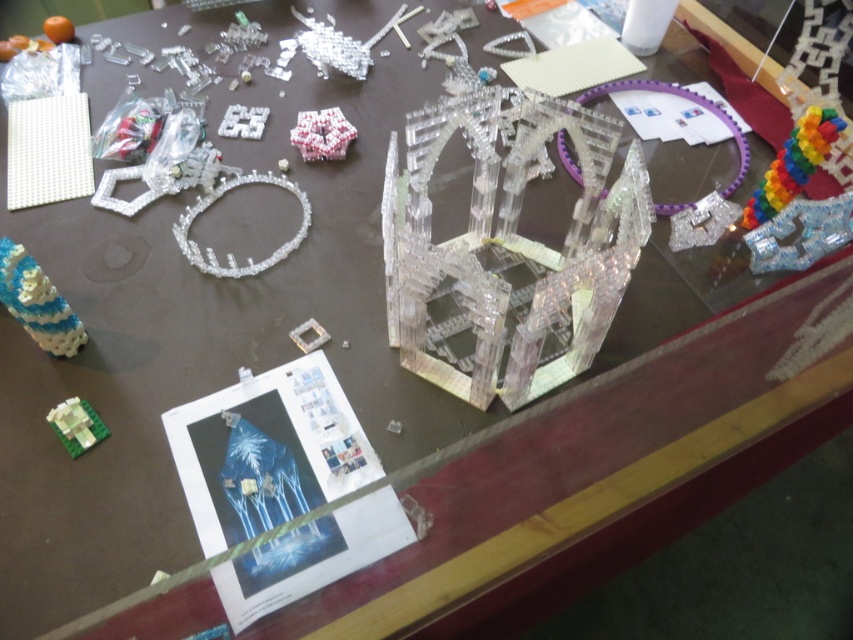
Is translucent plastic cube at center bigger than clear plastic square at center?

Yes.

Between translucent plastic cube at center and clear plastic square at center, which one is positioned higher?

translucent plastic cube at center is higher up.

Identify the location of translucent plastic cube at center. (322, 134).

Does translucent plastic rainbow cube at upper right have a larger size compared to clear plastic puzzle at upper center?

Indeed, translucent plastic rainbow cube at upper right has a larger size compared to clear plastic puzzle at upper center.

Looking at this image, who is taller, translucent plastic rainbow cube at upper right or clear plastic puzzle at upper center?

Standing taller between the two is translucent plastic rainbow cube at upper right.

Is point (759, 202) farther from camera compared to point (241, 115)?

No, (759, 202) is closer to viewer.

This screenshot has width=853, height=640. Identify the location of translucent plastic rainbow cube at upper right. (793, 163).

Is point (436, 276) behind point (74, 420)?

No, it is not.

Based on the photo, does transparent plastic tower at center appear under green matte block at lower left?

Actually, transparent plastic tower at center is above green matte block at lower left.

Does point (509, 266) come farther from viewer compared to point (90, 445)?

Yes, point (509, 266) is farther from viewer.

Where is `transparent plastic tower at center`? Image resolution: width=853 pixels, height=640 pixels. transparent plastic tower at center is located at coordinates (508, 248).